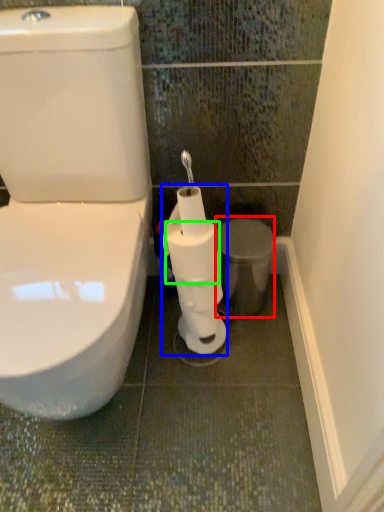
Question: Which is nearer to the porcelain (highlighted by a red box)? toilet paper (highlighted by a blue box) or toilet paper (highlighted by a green box).

Choices:
 (A) toilet paper
 (B) toilet paper

Answer: (B)